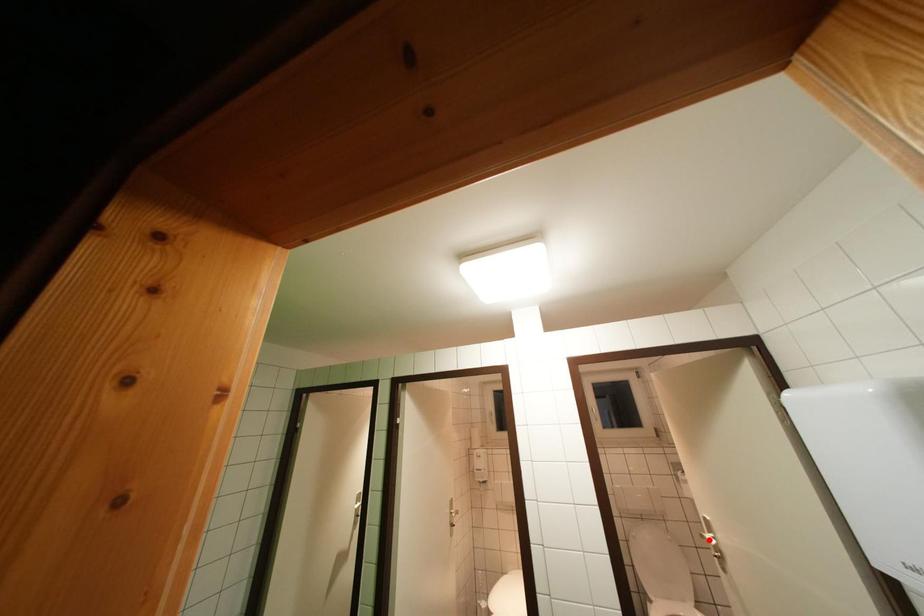
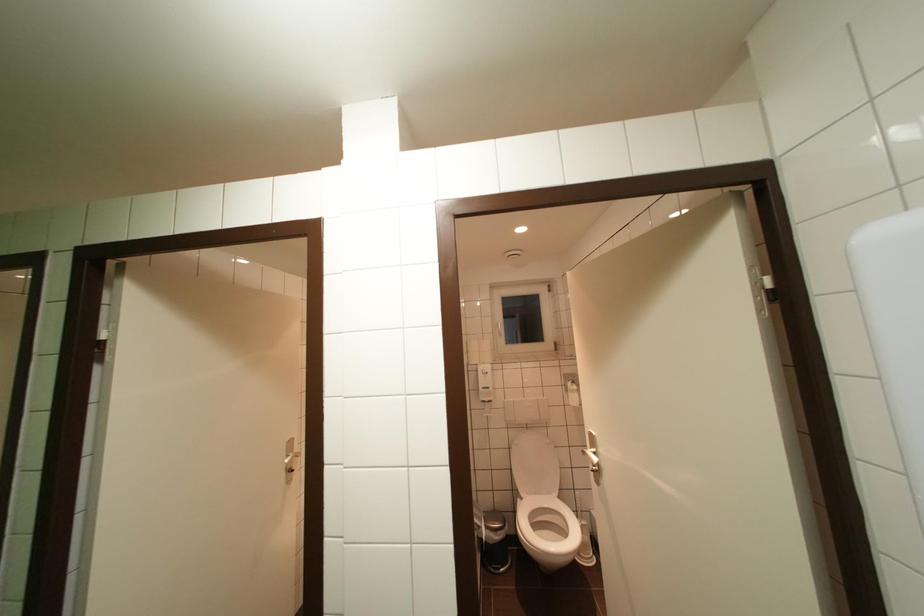
Find the pixel in the second image that matches the highlighted location in the first image.

(591, 456)